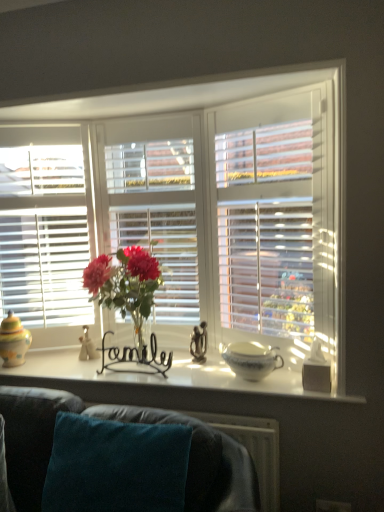
Question: Are white ceramic bowl at center and black wire at center, marked as the second candle holder in a back-to-front arrangement, far apart?

Choices:
 (A) no
 (B) yes

Answer: (A)

Question: Could you tell me if white ceramic bowl at center is turned towards black wire at center, which is the second candle holder from front to back?

Choices:
 (A) no
 (B) yes

Answer: (A)

Question: Is black wire at center, marked as the second candle holder in a back-to-front arrangement, at the back of white ceramic bowl at center?

Choices:
 (A) no
 (B) yes

Answer: (A)

Question: Does white ceramic bowl at center have a lesser height compared to black wire at center, marked as the second candle holder in a back-to-front arrangement?

Choices:
 (A) yes
 (B) no

Answer: (A)

Question: From a real-world perspective, is white ceramic bowl at center beneath black wire at center, the 2th candle holder when ordered from left to right?

Choices:
 (A) yes
 (B) no

Answer: (A)

Question: Relative to translucent glass vase at center, is multicolored ceramic jar at left, the 1th candle holder from the left, in front or behind?

Choices:
 (A) behind
 (B) front

Answer: (A)

Question: Is point (11, 318) closer or farther from the camera than point (119, 287)?

Choices:
 (A) closer
 (B) farther

Answer: (B)

Question: From the image's perspective, relative to translucent glass vase at center, is multicolored ceramic jar at left, which ranks as the third candle holder in right-to-left order, above or below?

Choices:
 (A) below
 (B) above

Answer: (A)

Question: Is multicolored ceramic jar at left, which ranks as the third candle holder in right-to-left order, wider or thinner than translucent glass vase at center?

Choices:
 (A) thin
 (B) wide

Answer: (A)

Question: Is translucent glass vase at center inside the boundaries of white wooden blinds at center, or outside?

Choices:
 (A) outside
 (B) inside

Answer: (A)

Question: From the image's perspective, relative to white wooden blinds at center, is translucent glass vase at center above or below?

Choices:
 (A) below
 (B) above

Answer: (A)

Question: From a real-world perspective, is translucent glass vase at center positioned above or below white wooden blinds at center?

Choices:
 (A) below
 (B) above

Answer: (A)

Question: Considering the positions of point (97, 281) and point (163, 89), is point (97, 281) closer or farther from the camera than point (163, 89)?

Choices:
 (A) farther
 (B) closer

Answer: (A)

Question: From a real-world perspective, relative to teal fabric couch at lower center, is black wire at center, positioned as the second candle holder in right-to-left order, vertically above or below?

Choices:
 (A) above
 (B) below

Answer: (A)

Question: In terms of size, does black wire at center, positioned as the second candle holder in right-to-left order, appear bigger or smaller than teal fabric couch at lower center?

Choices:
 (A) big
 (B) small

Answer: (B)